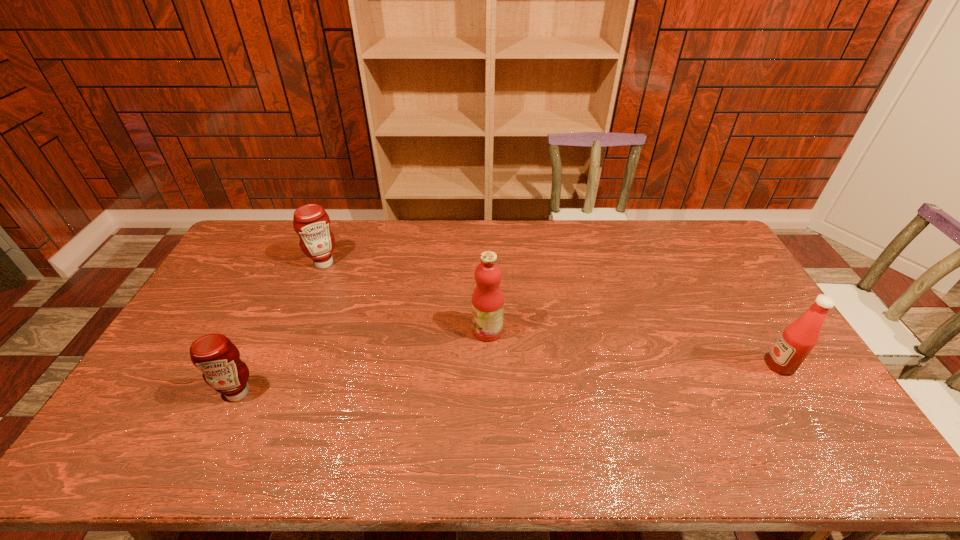
This screenshot has height=540, width=960. I want to click on vacant space located on the front-facing side of the second nearest condiment, so click(629, 365).

Locate an element on the screen. free region located 0.240m on the front-facing side of the second nearest condiment is located at coordinates (682, 365).

Where is `free space located on the front of the farthest condiment`? The height and width of the screenshot is (540, 960). free space located on the front of the farthest condiment is located at coordinates (302, 315).

Locate an element on the screen. The width and height of the screenshot is (960, 540). vacant space located 0.250m on the back of the nearest object is located at coordinates (275, 314).

At what (x,y) coordinates should I click in order to perform the action: click on object present at the far edge. Please return your answer as a coordinate pair (x, y). This screenshot has height=540, width=960. Looking at the image, I should click on (311, 222).

I want to click on object present at the right edge, so click(x=798, y=339).

In the image, there is a desktop. Identify the location of vacant space at the far edge. (518, 231).

Where is `vacant space at the near edge of the desktop`? vacant space at the near edge of the desktop is located at coordinates (633, 450).

The height and width of the screenshot is (540, 960). In the image, there is a desktop. In order to click on vacant area at the left edge in this screenshot , I will do `click(186, 326)`.

Find the location of a particular element. free region at the right edge of the desktop is located at coordinates (740, 323).